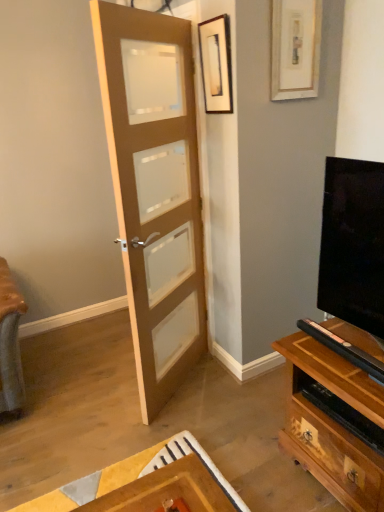
Locate an element on the screen. The image size is (384, 512). matte wood door at center is located at coordinates (154, 189).

Looking at this image, what is the approximate height of black glossy tv at right?

The height of black glossy tv at right is 37.83 inches.

Identify the location of black glossy tv at right. The width and height of the screenshot is (384, 512). (353, 244).

Where is `white matte picture frame at upper right, which is the 1th picture frame in right-to-left order`? white matte picture frame at upper right, which is the 1th picture frame in right-to-left order is located at coordinates (295, 48).

At what (x,y) coordinates should I click in order to perform the action: click on wooden framed picture at upper center, the first picture frame when ordered from left to right. Please return your answer as a coordinate pair (x, y). The width and height of the screenshot is (384, 512). Looking at the image, I should click on (216, 64).

Considering the sizes of white matte picture frame at upper right, the 2th picture frame positioned from the left, and black glossy tv at right in the image, is white matte picture frame at upper right, the 2th picture frame positioned from the left, bigger or smaller than black glossy tv at right?

Considering their sizes, white matte picture frame at upper right, the 2th picture frame positioned from the left, takes up less space than black glossy tv at right.

Considering the positions of objects white matte picture frame at upper right, which is the 1th picture frame in right-to-left order, and black glossy tv at right in the image provided, who is in front, white matte picture frame at upper right, which is the 1th picture frame in right-to-left order, or black glossy tv at right?

white matte picture frame at upper right, which is the 1th picture frame in right-to-left order, is in front.

Which is in front, point (306, 26) or point (330, 286)?

The point (330, 286) is in front.

From the image's perspective, relative to black glossy tv at right, is white matte picture frame at upper right, which is the 1th picture frame in right-to-left order, above or below?

Clearly, from the image's perspective, white matte picture frame at upper right, which is the 1th picture frame in right-to-left order, is above black glossy tv at right.

Are wooden framed picture at upper center, acting as the second picture frame starting from the right, and matte wood door at center located far from each other?

No, wooden framed picture at upper center, acting as the second picture frame starting from the right, is not far away from matte wood door at center.

From a real-world perspective, is wooden framed picture at upper center, acting as the second picture frame starting from the right, physically located above or below matte wood door at center?

In terms of real-world spatial position, wooden framed picture at upper center, acting as the second picture frame starting from the right, is above matte wood door at center.

Based on the photo, which object is more forward, wooden framed picture at upper center, the first picture frame when ordered from left to right, or matte wood door at center?

matte wood door at center is closer to the camera.

Consider the image. From a real-world perspective, is matte wood door at center positioned above or below wooden framed picture at upper center, the first picture frame when ordered from left to right?

From a real-world perspective, matte wood door at center is physically below wooden framed picture at upper center, the first picture frame when ordered from left to right.

Considering the sizes of objects matte wood door at center and wooden framed picture at upper center, the first picture frame when ordered from left to right, in the image provided, who is shorter, matte wood door at center or wooden framed picture at upper center, the first picture frame when ordered from left to right,?

wooden framed picture at upper center, the first picture frame when ordered from left to right.

Between matte wood door at center and wooden framed picture at upper center, acting as the second picture frame starting from the right, which one appears on the left side from the viewer's perspective?

matte wood door at center is more to the left.

Is point (159, 257) closer or farther from the camera than point (205, 46)?

Point (159, 257) is farther from the camera than point (205, 46).

What's the angular difference between wooden framed picture at upper center, acting as the second picture frame starting from the right, and black glossy tv at right's facing directions?

0.029 degrees.

Does wooden framed picture at upper center, acting as the second picture frame starting from the right, lie in front of black glossy tv at right?

That is True.

Is wooden framed picture at upper center, the first picture frame when ordered from left to right, looking in the opposite direction of black glossy tv at right?

That's not correct — wooden framed picture at upper center, the first picture frame when ordered from left to right, is not looking away from black glossy tv at right.

Based on the photo, is wooden framed picture at upper center, the first picture frame when ordered from left to right, at the left side of black glossy tv at right?

Correct, you'll find wooden framed picture at upper center, the first picture frame when ordered from left to right, to the left of black glossy tv at right.

Can you confirm if matte wood door at center is thinner than black glossy tv at right?

Correct, the width of matte wood door at center is less than that of black glossy tv at right.

Is the position of matte wood door at center more distant than that of black glossy tv at right?

No, the depth of matte wood door at center is less than that of black glossy tv at right.

Could you tell me if matte wood door at center is turned towards black glossy tv at right?

No, matte wood door at center is not turned towards black glossy tv at right.

Is matte wood door at center shorter than black glossy tv at right?

In fact, matte wood door at center may be taller than black glossy tv at right.

Between white matte picture frame at upper right, which is the 1th picture frame in right-to-left order, and matte wood door at center, which one is positioned behind?

white matte picture frame at upper right, which is the 1th picture frame in right-to-left order.

Considering the sizes of white matte picture frame at upper right, the 2th picture frame positioned from the left, and matte wood door at center in the image, is white matte picture frame at upper right, the 2th picture frame positioned from the left, bigger or smaller than matte wood door at center?

Considering their sizes, white matte picture frame at upper right, the 2th picture frame positioned from the left, takes up less space than matte wood door at center.

From the picture: From a real-world perspective, is white matte picture frame at upper right, the 2th picture frame positioned from the left, located beneath matte wood door at center?

No.

Is matte wood door at center inside white matte picture frame at upper right, the 2th picture frame positioned from the left?

That's incorrect, matte wood door at center is not inside white matte picture frame at upper right, the 2th picture frame positioned from the left.

From the image's perspective, is white matte picture frame at upper right, the 2th picture frame positioned from the left, positioned above or below wooden framed picture at upper center, acting as the second picture frame starting from the right?

Based on their image positions, white matte picture frame at upper right, the 2th picture frame positioned from the left, is located above wooden framed picture at upper center, acting as the second picture frame starting from the right.

Find the location of a particular element. The height and width of the screenshot is (512, 384). picture frame behind the wooden framed picture at upper center, the first picture frame when ordered from left to right is located at coordinates (295, 48).

Is white matte picture frame at upper right, the 2th picture frame positioned from the left, wider or thinner than wooden framed picture at upper center, the first picture frame when ordered from left to right?

Considering their sizes, white matte picture frame at upper right, the 2th picture frame positioned from the left, looks slimmer than wooden framed picture at upper center, the first picture frame when ordered from left to right.

Find the location of a particular element. the 1st picture frame in front of the black glossy tv at right is located at coordinates (295, 48).

Which picture frame is the 1st one when counting from the right side of the matte wood door at center? Please provide its 2D coordinates.

[(216, 64)]

Considering their positions, is matte wood door at center positioned closer to wooden framed picture at upper center, acting as the second picture frame starting from the right, than black glossy tv at right?

matte wood door at center is closer to wooden framed picture at upper center, acting as the second picture frame starting from the right.

When comparing their distances from white matte picture frame at upper right, the 2th picture frame positioned from the left, does matte wood door at center or black glossy tv at right seem further?

black glossy tv at right.

When comparing their distances from matte wood door at center, does white matte picture frame at upper right, which is the 1th picture frame in right-to-left order, or black glossy tv at right seem further?

black glossy tv at right is positioned further to the anchor matte wood door at center.

From the picture: Considering their positions, is white matte picture frame at upper right, which is the 1th picture frame in right-to-left order, positioned closer to black glossy tv at right than matte wood door at center?

white matte picture frame at upper right, which is the 1th picture frame in right-to-left order.

Based on their spatial positions, is black glossy tv at right or wooden framed picture at upper center, acting as the second picture frame starting from the right, closer to white matte picture frame at upper right, which is the 1th picture frame in right-to-left order?

wooden framed picture at upper center, acting as the second picture frame starting from the right, is closer to white matte picture frame at upper right, which is the 1th picture frame in right-to-left order.

Based on their spatial positions, is black glossy tv at right or white matte picture frame at upper right, the 2th picture frame positioned from the left, further from wooden framed picture at upper center, the first picture frame when ordered from left to right?

black glossy tv at right is positioned further to the anchor wooden framed picture at upper center, the first picture frame when ordered from left to right.

Looking at the image, which one is located closer to black glossy tv at right, wooden framed picture at upper center, acting as the second picture frame starting from the right, or matte wood door at center?

Based on the image, matte wood door at center appears to be nearer to black glossy tv at right.

From the image, which object appears to be farther from matte wood door at center, black glossy tv at right or wooden framed picture at upper center, acting as the second picture frame starting from the right?

black glossy tv at right.

The height and width of the screenshot is (512, 384). I want to click on door that lies between white matte picture frame at upper right, the 2th picture frame positioned from the left, and black glossy tv at right from top to bottom, so tap(154, 189).

The width and height of the screenshot is (384, 512). I want to click on door between wooden framed picture at upper center, the first picture frame when ordered from left to right, and black glossy tv at right in the up-down direction, so click(x=154, y=189).

This screenshot has height=512, width=384. In order to click on picture frame between white matte picture frame at upper right, the 2th picture frame positioned from the left, and matte wood door at center vertically in this screenshot , I will do `click(216, 64)`.

The height and width of the screenshot is (512, 384). Find the location of `picture frame that lies between white matte picture frame at upper right, the 2th picture frame positioned from the left, and black glossy tv at right from top to bottom`. picture frame that lies between white matte picture frame at upper right, the 2th picture frame positioned from the left, and black glossy tv at right from top to bottom is located at coordinates (216, 64).